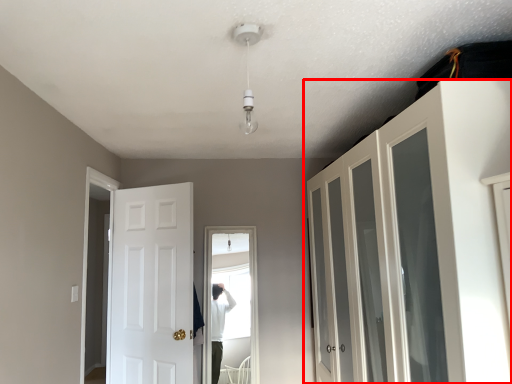
Question: In this image, where is cupboard (annotated by the red box) located relative to door?

Choices:
 (A) left
 (B) right

Answer: (B)